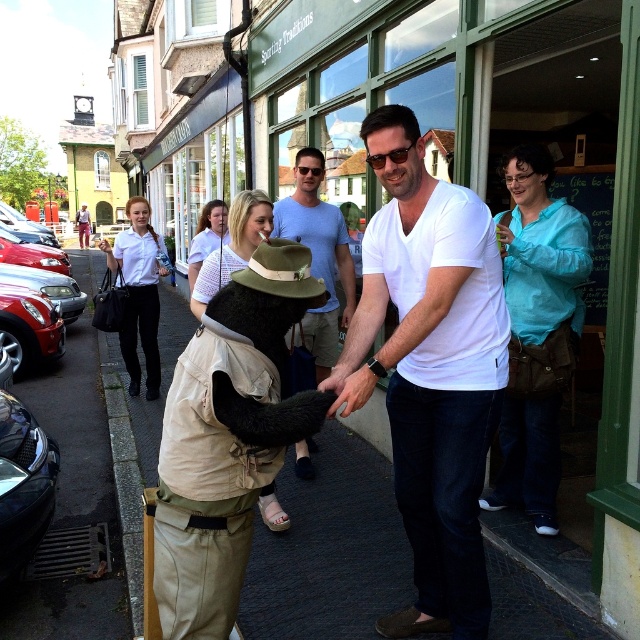
Which of these two, khakimaterial/texture at center or green felt cowboy hat at center, stands shorter?

green felt cowboy hat at center

Can you confirm if khakimaterial/texture at center is taller than green felt cowboy hat at center?

Yes, khakimaterial/texture at center is taller than green felt cowboy hat at center.

Does point (262, 276) come farther from viewer compared to point (260, 269)?

No.

In order to click on khakimaterial/texture at center in this screenshot , I will do `click(228, 436)`.

Can you confirm if white cotton shirt at center is positioned to the left of khakimaterial/texture at center?

In fact, white cotton shirt at center is to the right of khakimaterial/texture at center.

Is the position of white cotton shirt at center more distant than that of khakimaterial/texture at center?

Yes, it is behind khakimaterial/texture at center.

Does point (417, 593) come closer to viewer compared to point (248, 422)?

No, it is not.

Where is `white cotton shirt at center`? white cotton shirt at center is located at coordinates (429, 369).

Is blue fabric shirt at upper right positioned at the back of light blue cotton shirt at center?

No, blue fabric shirt at upper right is closer to the viewer.

Does blue fabric shirt at upper right have a lesser height compared to light blue cotton shirt at center?

In fact, blue fabric shirt at upper right may be taller than light blue cotton shirt at center.

Is point (554, 253) farther from viewer compared to point (314, 317)?

No, it is not.

Locate an element on the screen. blue fabric shirt at upper right is located at coordinates (538, 332).